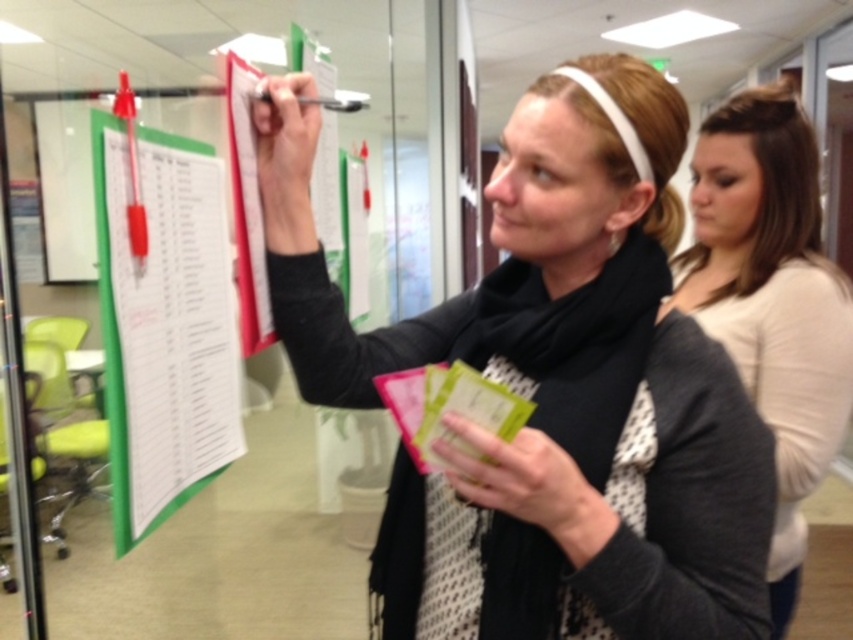
Question: Can you confirm if white matte shirt at upper right is wider than green paperboard at left?

Choices:
 (A) yes
 (B) no

Answer: (A)

Question: Which point is farther to the camera?

Choices:
 (A) (769, 324)
 (B) (761, 628)

Answer: (A)

Question: Which object is closer to the camera taking this photo?

Choices:
 (A) black matte scarf at upper center
 (B) green paperboard at left
 (C) white matte shirt at upper right

Answer: (A)

Question: Is white matte shirt at upper right below green paperboard at left?

Choices:
 (A) no
 (B) yes

Answer: (B)

Question: Based on their relative distances, which object is nearer to the black matte scarf at upper center?

Choices:
 (A) white matte shirt at upper right
 (B) green paperboard at left

Answer: (B)

Question: Does black matte scarf at upper center appear on the right side of green paperboard at left?

Choices:
 (A) no
 (B) yes

Answer: (B)